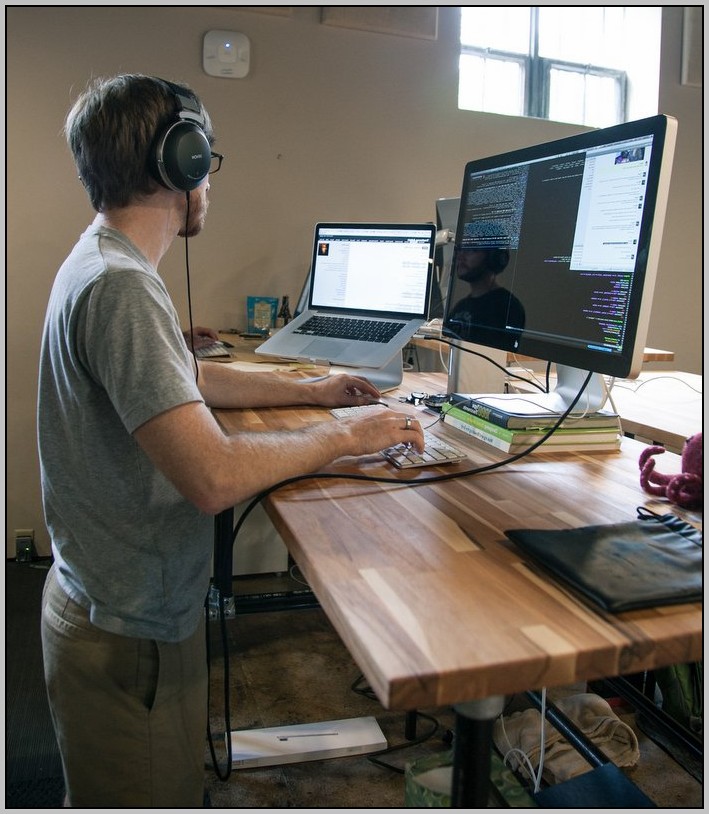
At what (x,y) coordinates should I click in order to perform the action: click on wooden table top. Please return your answer as a coordinate pair (x, y). Looking at the image, I should click on (411, 565).